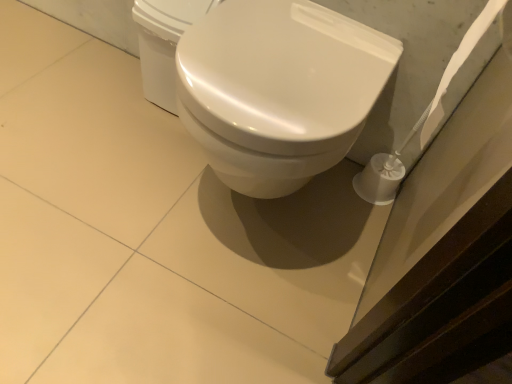
Identify the location of free spot in front of white glossy toilet at upper center. (144, 137).